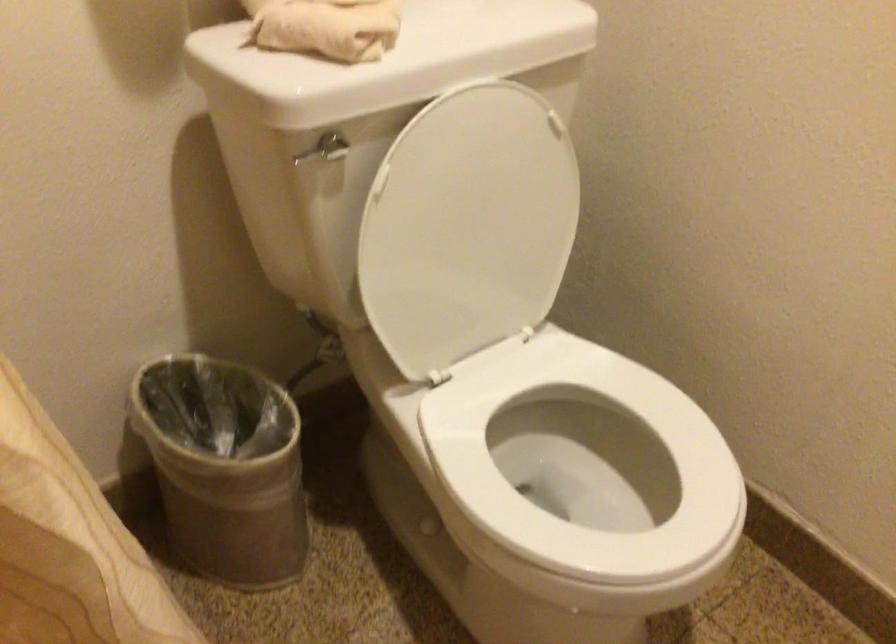
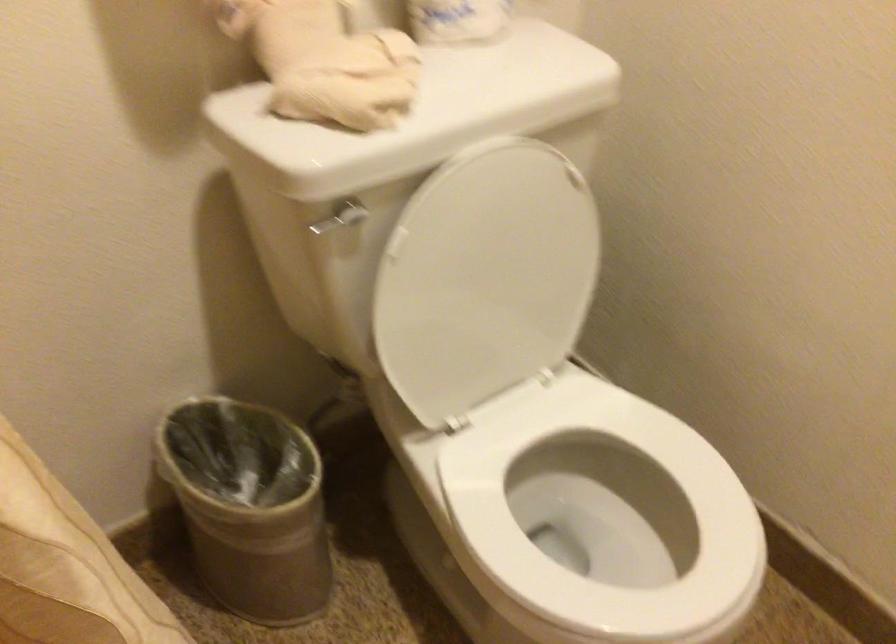
Question: Based on the continuous images, in which direction is the camera rotating? Reply with the corresponding letter.

Choices:
 (A) Left
 (B) Right
 (C) Up
 (D) Down

Answer: (A)